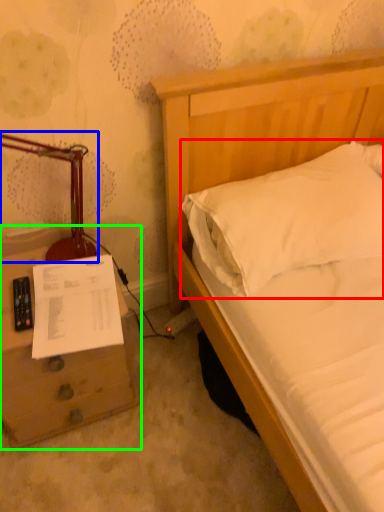
Question: Considering the real-world distances, which object is closest to pillow (highlighted by a red box)? table lamp (highlighted by a blue box) or nightstand (highlighted by a green box).

Choices:
 (A) table lamp
 (B) nightstand

Answer: (A)